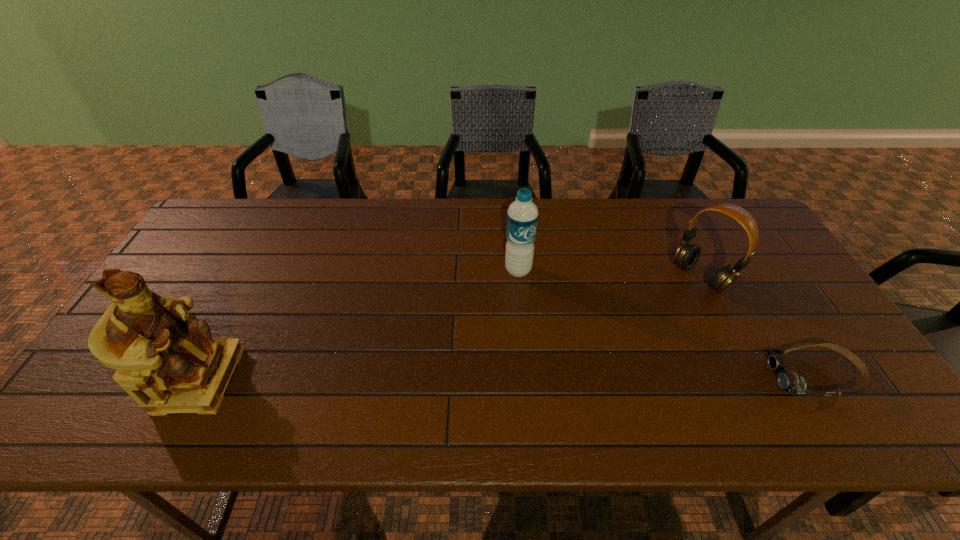
You are a GUI agent. You are given a task and a screenshot of the screen. Output one action in this format:
    pyautogui.click(x=<x>, y=<y>)
    Task: Click on the vacant space on the desktop that is between the figurine and the shortest object and is positioned on the label of the third shortest object
    The height and width of the screenshot is (540, 960).
    Given the screenshot: What is the action you would take?
    pyautogui.click(x=578, y=377)

Identify the location of vacant space on the desktop that is between the tallest object and the shortest object and is positioned on the ear cups of the second shortest object. The height and width of the screenshot is (540, 960). point(565,377).